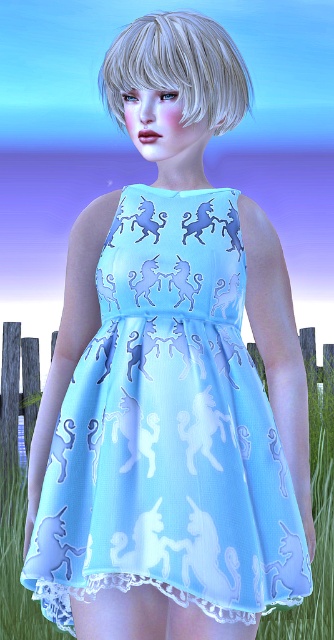
Which of these two, blonde silky hair at upper center or wooden fence at lower center, stands taller?

wooden fence at lower center is taller.

Is blonde silky hair at upper center further to camera compared to wooden fence at lower center?

No, it is in front of wooden fence at lower center.

Is point (201, 36) farther from viewer compared to point (17, 451)?

That is False.

This screenshot has width=334, height=640. I want to click on blonde silky hair at upper center, so click(x=179, y=68).

Measure the distance between light blue fabric dress at center and wooden fence at lower center.

light blue fabric dress at center is 23.44 feet from wooden fence at lower center.

Between point (120, 252) and point (315, 436), which one is positioned behind?

Point (315, 436)

The image size is (334, 640). I want to click on light blue fabric dress at center, so click(x=169, y=429).

Can you confirm if light blue fabric dress at center is wider than blonde silky hair at upper center?

Correct, the width of light blue fabric dress at center exceeds that of blonde silky hair at upper center.

Can you confirm if light blue fabric dress at center is positioned to the right of blonde silky hair at upper center?

In fact, light blue fabric dress at center is to the left of blonde silky hair at upper center.

Which is in front, point (170, 524) or point (165, 77)?

Point (170, 524) is in front.

You are a GUI agent. You are given a task and a screenshot of the screen. Output one action in this format:
    pyautogui.click(x=<x>, y=<y>)
    Task: Click on the light blue fabric dress at center
    The width and height of the screenshot is (334, 640).
    Given the screenshot: What is the action you would take?
    pyautogui.click(x=169, y=429)